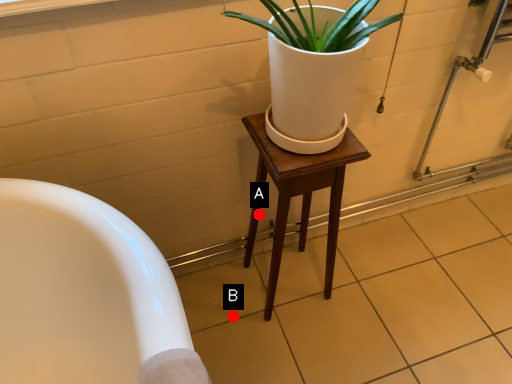
Question: Two points are circled on the image, labeled by A and B beside each circle. Among these points, which one is farthest from the camera?

Choices:
 (A) A is further
 (B) B is further

Answer: (B)